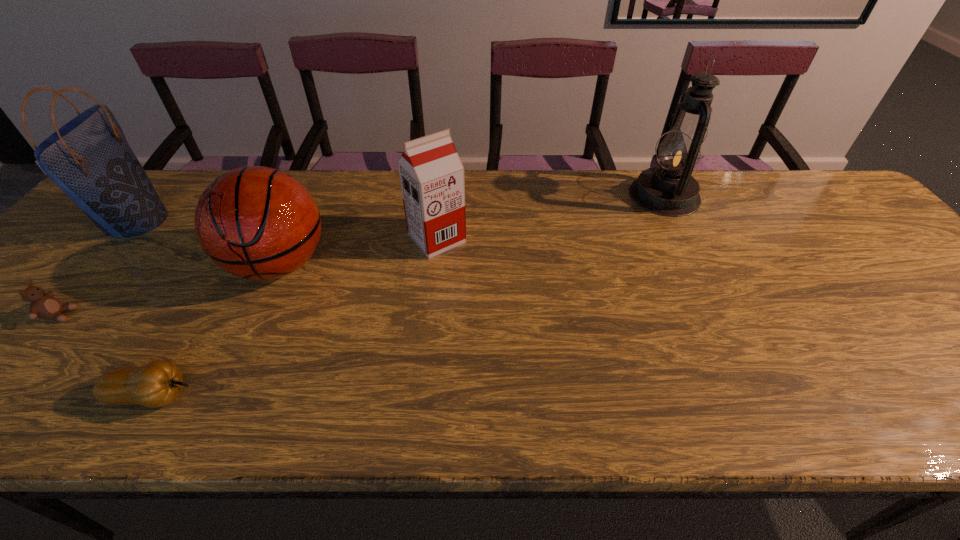
Where is `free space at the right edge of the desktop`? The height and width of the screenshot is (540, 960). free space at the right edge of the desktop is located at coordinates [x=860, y=268].

The height and width of the screenshot is (540, 960). In order to click on vacant area at the far left corner in this screenshot , I will do `click(179, 183)`.

Image resolution: width=960 pixels, height=540 pixels. I want to click on free space between the gourd and the oil lamp, so click(x=409, y=296).

Identify the location of free space that is in between the gourd and the shopping bag. Image resolution: width=960 pixels, height=540 pixels. (145, 308).

The height and width of the screenshot is (540, 960). Identify the location of unoccupied area between the gourd and the basketball. (217, 330).

Where is `vacant region between the rightmost object and the shopping bag`? The width and height of the screenshot is (960, 540). vacant region between the rightmost object and the shopping bag is located at coordinates (400, 208).

I want to click on vacant area between the oil lamp and the fifth object from left to right, so click(551, 217).

In order to click on free spot between the shopping bag and the oil lamp in this screenshot , I will do `click(400, 208)`.

In order to click on vacant space that is in between the nearest object and the second object from right to left in this screenshot , I will do `click(296, 318)`.

I want to click on empty location between the rightmost object and the basketball, so click(471, 230).